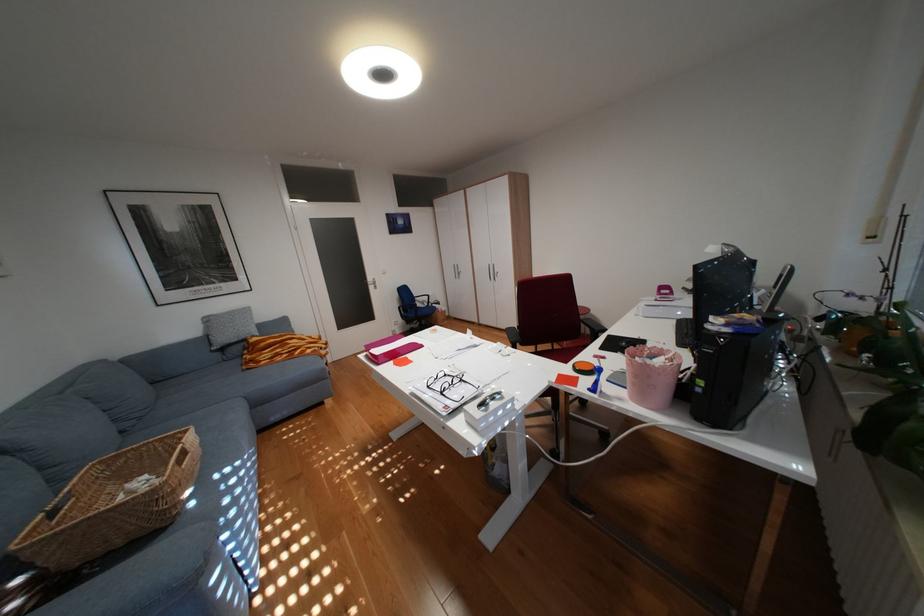
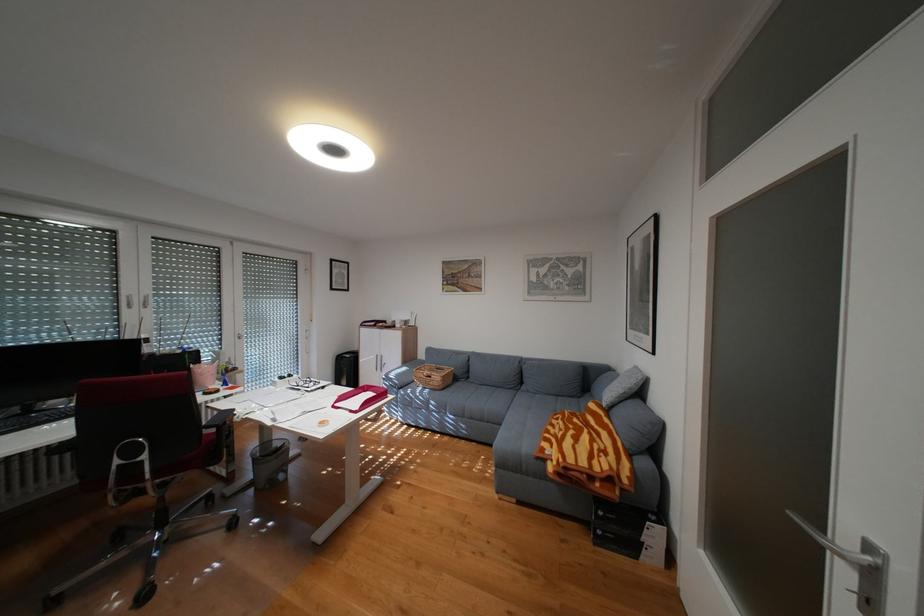
Locate, in the second image, the point that corresponds to (322,347) in the first image.

(564, 445)